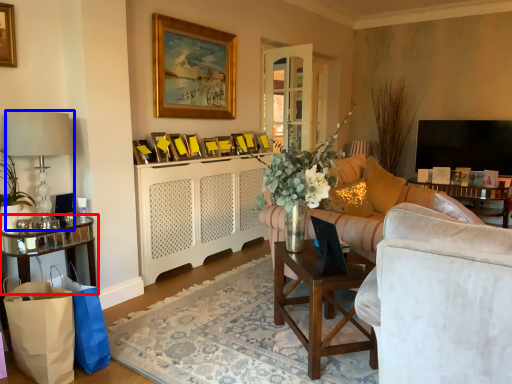
Question: Which of the following is the closest to the observer, table (highlighted by a red box) or lamp (highlighted by a blue box)?

Choices:
 (A) table
 (B) lamp

Answer: (B)